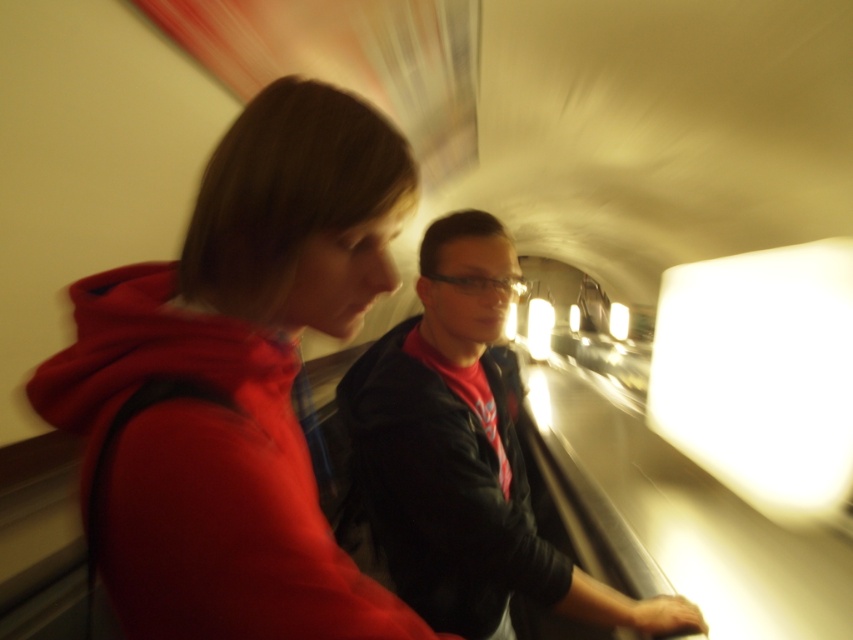
The image size is (853, 640). Find the location of `matte red hoodie at left`. matte red hoodie at left is located at coordinates (238, 380).

How distant is matte red hoodie at left from matte black jacket at center?

They are 21.68 inches apart.

The image size is (853, 640). Identify the location of matte red hoodie at left. (238, 380).